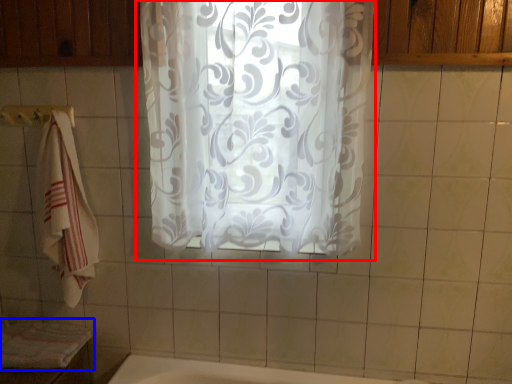
Question: Among these objects, which one is farthest to the camera, curtain (highlighted by a red box) or bath towel (highlighted by a blue box)?

Choices:
 (A) curtain
 (B) bath towel

Answer: (B)